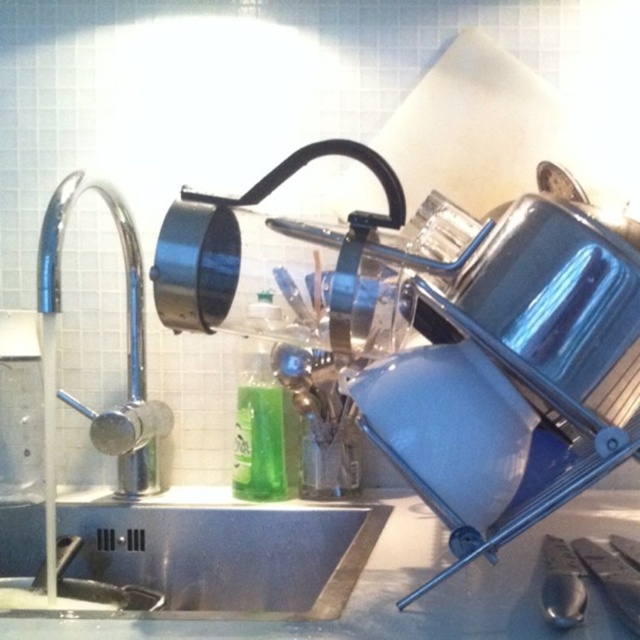
Between stainless steel sink at lower left and chrome/metallic faucet at left, which one has less height?

With less height is stainless steel sink at lower left.

Which is below, stainless steel sink at lower left or chrome/metallic faucet at left?

stainless steel sink at lower left is lower down.

Where is `stainless steel sink at lower left`? stainless steel sink at lower left is located at coordinates (228, 554).

Who is shorter, stainless steel sink at left or green translucent bottle at center?

green translucent bottle at center

Which is behind, point (90, 557) or point (266, 486)?

The point (90, 557) is behind.

Where is `stainless steel sink at left`? The height and width of the screenshot is (640, 640). stainless steel sink at left is located at coordinates (156, 508).

Is the position of stainless steel sink at lower left less distant than that of green translucent bottle at center?

Yes, stainless steel sink at lower left is in front of green translucent bottle at center.

I want to click on stainless steel sink at lower left, so click(228, 554).

Where is `stainless steel sink at lower left`? Image resolution: width=640 pixels, height=640 pixels. stainless steel sink at lower left is located at coordinates pos(228,554).